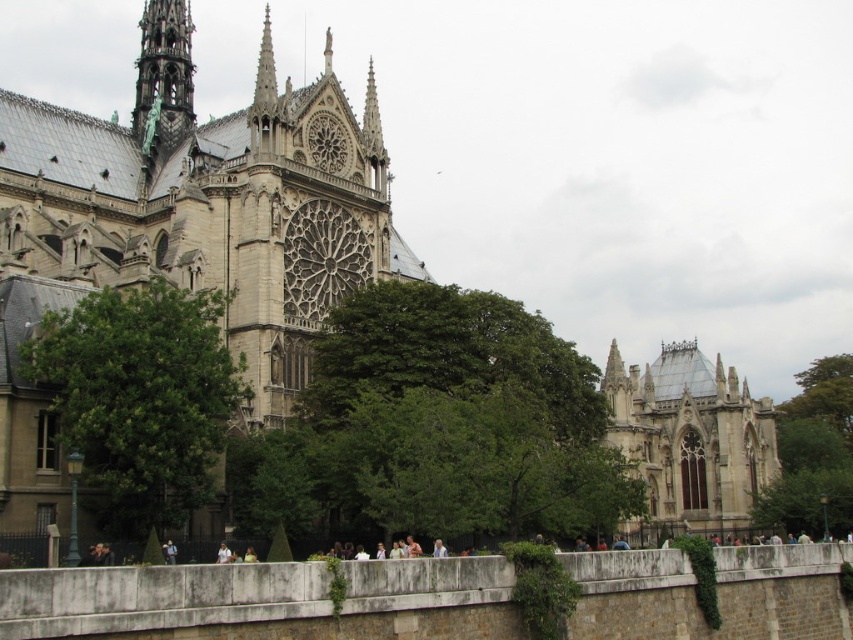
Can you confirm if green leafy tree at center is positioned to the right of light blue denim jacket at lower center?

Indeed, green leafy tree at center is positioned on the right side of light blue denim jacket at lower center.

Who is higher up, green leafy tree at center or light blue denim jacket at lower center?

Positioned higher is green leafy tree at center.

Is point (461, 296) positioned before point (442, 541)?

No, it is not.

You are a GUI agent. You are given a task and a screenshot of the screen. Output one action in this format:
    pyautogui.click(x=<x>, y=<y>)
    Task: Click on the green leafy tree at center
    
    Given the screenshot: What is the action you would take?
    click(x=456, y=419)

Does light brown hair at lower center come behind light blue denim jacket at lower center?

Yes, light brown hair at lower center is further from the viewer.

Does point (216, 556) lie behind point (437, 556)?

Yes, point (216, 556) is behind point (437, 556).

Measure the distance between light brown hair at lower center and camera.

The distance of light brown hair at lower center from camera is 54.91 meters.

At what (x,y) coordinates should I click in order to perform the action: click on light brown hair at lower center. Please return your answer as a coordinate pair (x, y). This screenshot has height=640, width=853. Looking at the image, I should click on (223, 554).

Does point (149, 4) come behind point (437, 540)?

Yes.

Is polished bronze statue at upper left in front of light blue denim jacket at lower center?

No, polished bronze statue at upper left is further to the viewer.

Is point (152, 100) positioned before point (442, 545)?

No, (152, 100) is further to viewer.

Find the location of a particular element. This screenshot has width=853, height=640. polished bronze statue at upper left is located at coordinates (163, 76).